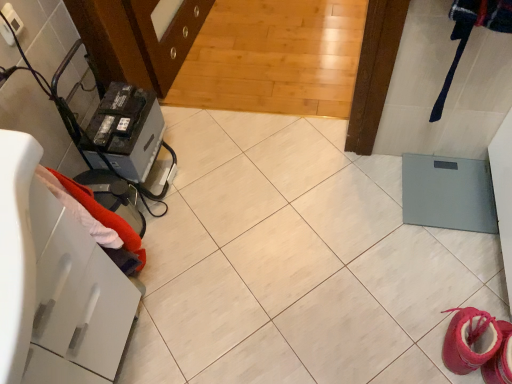
Question: In terms of height, does white glossy drawer at left look taller or shorter compared to pink suede booties at lower right?

Choices:
 (A) tall
 (B) short

Answer: (A)

Question: From the image's perspective, is white glossy drawer at left located above or below pink suede booties at lower right?

Choices:
 (A) above
 (B) below

Answer: (A)

Question: Estimate the real-world distances between objects in this image. Which object is farther from the black plastic battery at left?

Choices:
 (A) white glossy drawer at left
 (B) red fabric towel at left
 (C) pink suede booties at lower right

Answer: (C)

Question: Which object is the farthest from the black plastic battery at left?

Choices:
 (A) white glossy drawer at left
 (B) pink suede booties at lower right
 (C) red fabric towel at left

Answer: (B)